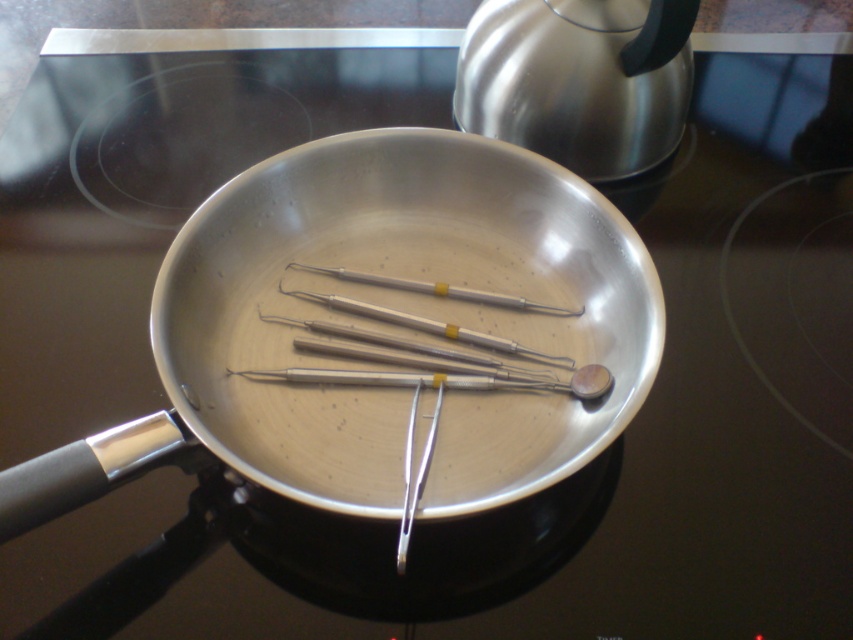
Is brushed metal teapot at upper right in front of satin silver metal probe at center?

No, it is not.

Does brushed metal teapot at upper right have a greater width compared to satin silver metal probe at center?

No.

Which is in front, point (480, 125) or point (387, 372)?

Positioned in front is point (387, 372).

You are a GUI agent. You are given a task and a screenshot of the screen. Output one action in this format:
    pyautogui.click(x=<x>, y=<y>)
    Task: Click on the brushed metal teapot at upper right
    
    Given the screenshot: What is the action you would take?
    pyautogui.click(x=578, y=80)